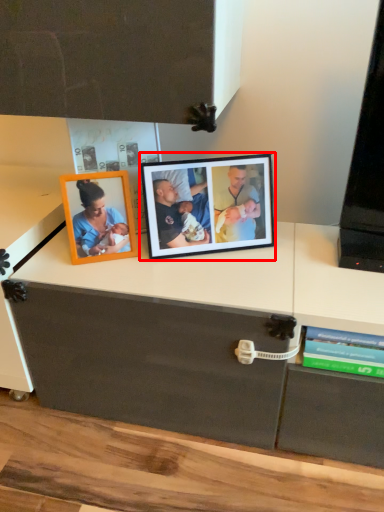
Question: In this image, where is picture frame (annotated by the red box) located relative to book?

Choices:
 (A) left
 (B) right

Answer: (A)